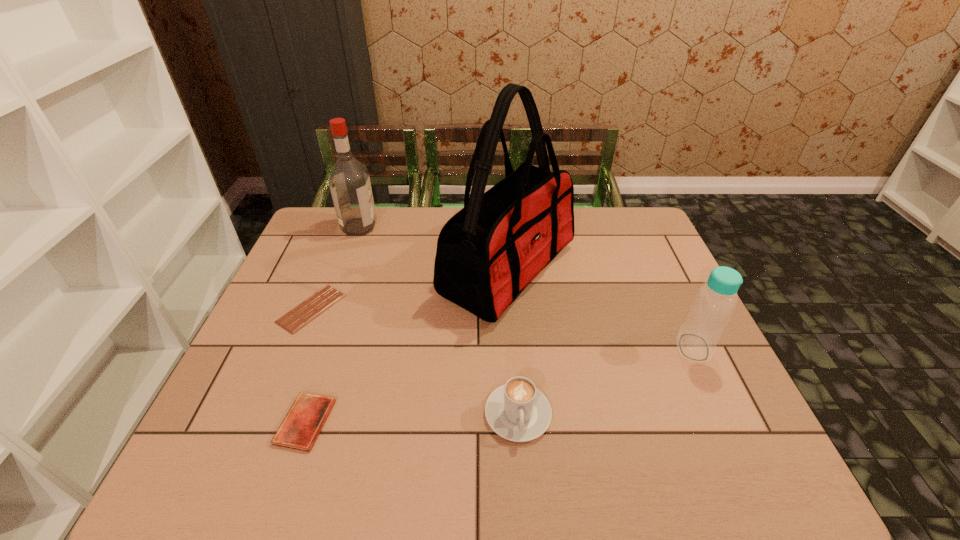
Identify the location of object that stands as the fifth closest to the fourth tallest object. (349, 181).

Locate an element on the screen. blank space that satisfies the following two spatial constraints: 1. on the back side of the diary; 2. on the front-facing side of the liquor is located at coordinates (371, 226).

Where is `free space that satisfies the following two spatial constraints: 1. on the front side of the third tallest object; 2. on the left side of the shortest object`? free space that satisfies the following two spatial constraints: 1. on the front side of the third tallest object; 2. on the left side of the shortest object is located at coordinates (296, 347).

At what (x,y) coordinates should I click in order to perform the action: click on vacant space that satisfies the following two spatial constraints: 1. on the front-facing side of the rightmost object; 2. on the left side of the fifth shortest object. Please return your answer as a coordinate pair (x, y). Looking at the image, I should click on (316, 347).

Find the location of a particular element. The height and width of the screenshot is (540, 960). free point that satisfies the following two spatial constraints: 1. on the front-facing side of the liquor; 2. on the back side of the bottle is located at coordinates (316, 347).

Where is `vacant area in the image that satisfies the following two spatial constraints: 1. on the front-facing side of the tallest object; 2. on the left side of the liquor`? This screenshot has height=540, width=960. vacant area in the image that satisfies the following two spatial constraints: 1. on the front-facing side of the tallest object; 2. on the left side of the liquor is located at coordinates (344, 269).